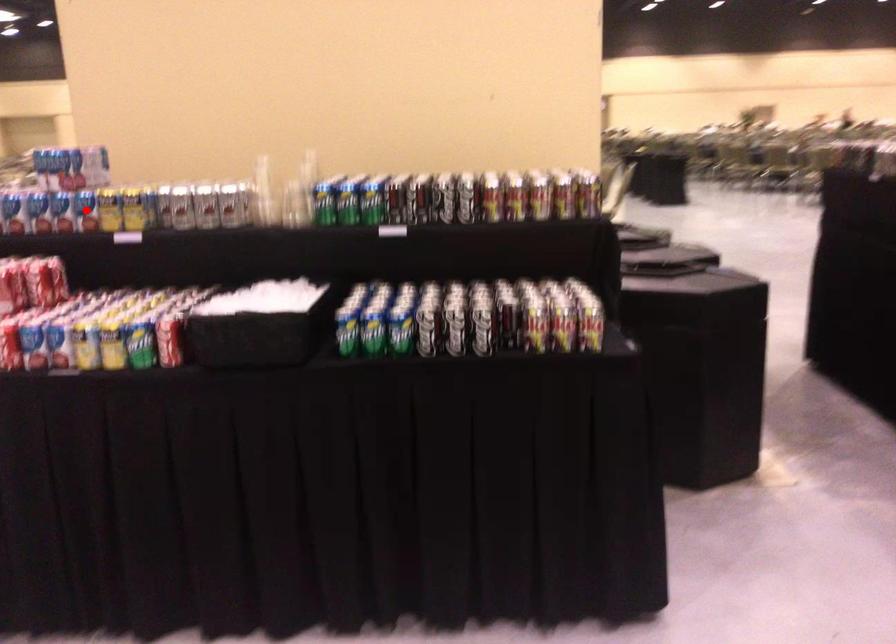
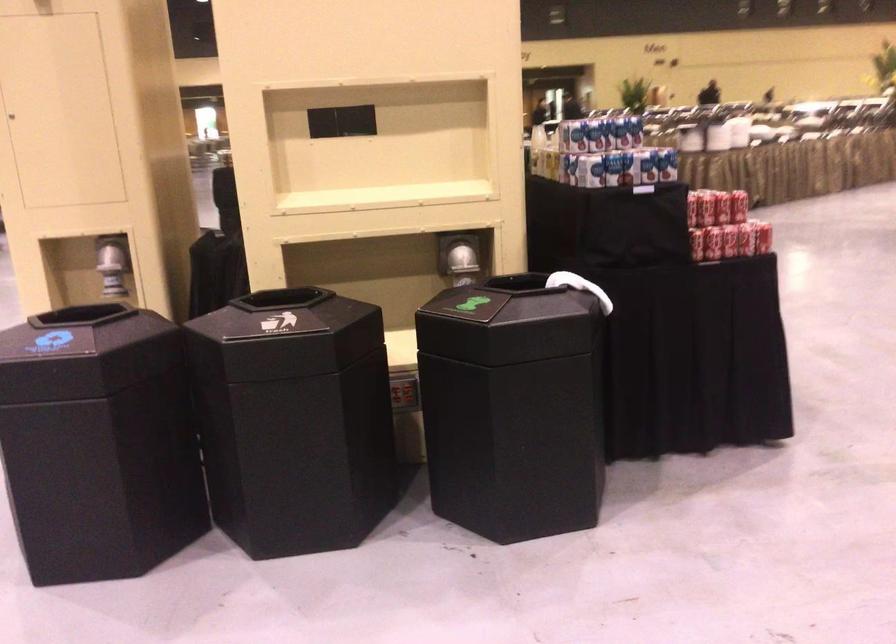
Question: I am providing you with two images of the same scene from different viewpoints. A red point is marked on the first image. At the location where the point appears in image 1, is it still visible in image 2?

Choices:
 (A) Yes
 (B) No

Answer: (B)